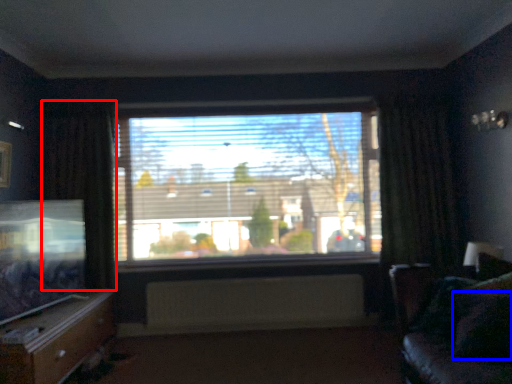
Question: Among these objects, which one is nearest to the camera, curtain (highlighted by a red box) or pillow (highlighted by a blue box)?

Choices:
 (A) curtain
 (B) pillow

Answer: (B)